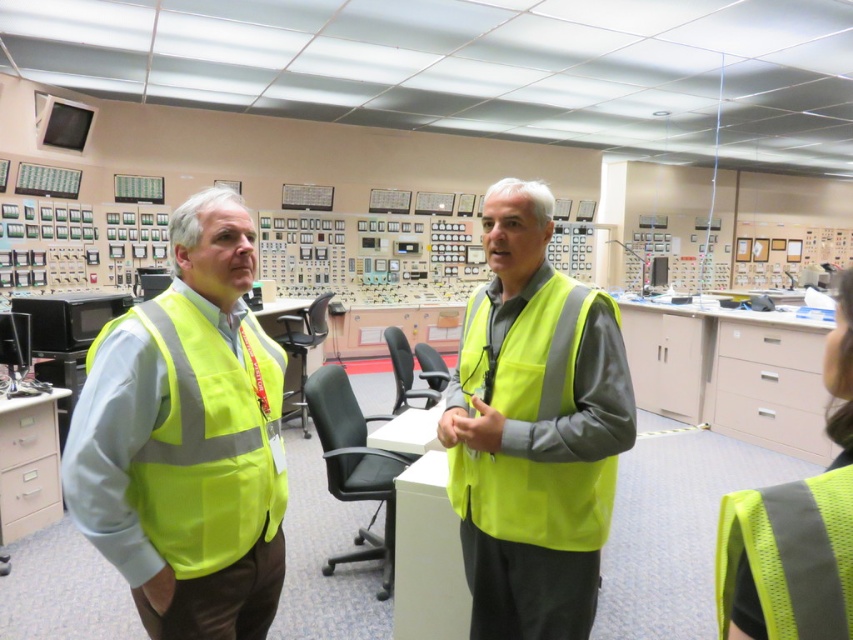
You are standing in the control room and need to determine which of the two points, point (241, 429) or point (538, 336), is closer to you. Based on the coordinates provided, which point is nearer?

Point (241, 429) is closer to the camera than point (538, 336), so it is the nearer point.